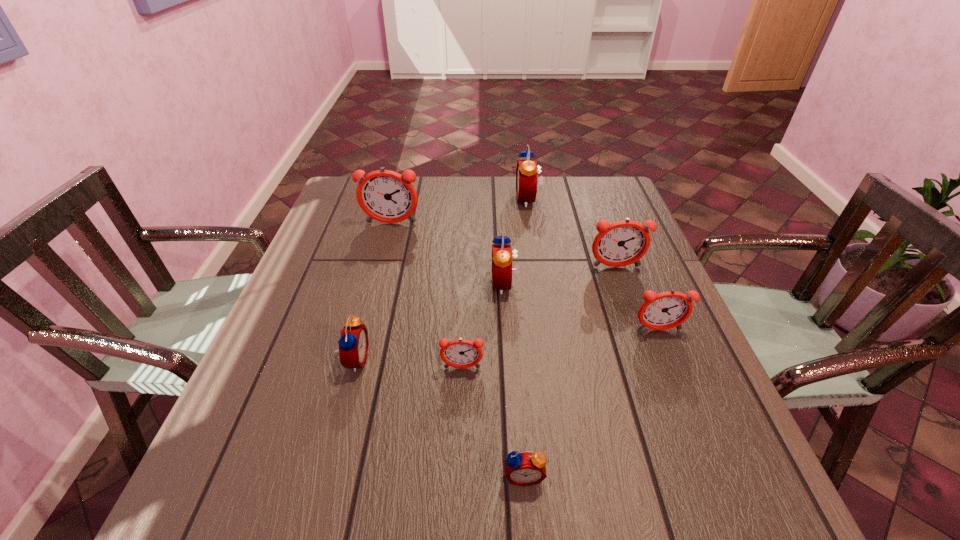
Where is `the farthest red alarm clock`? The width and height of the screenshot is (960, 540). the farthest red alarm clock is located at coordinates (526, 172).

The width and height of the screenshot is (960, 540). Find the location of `the sixth object from left to right`. the sixth object from left to right is located at coordinates (526, 172).

At what (x,y) coordinates should I click in order to perform the action: click on the leftmost reddish-pink alarm clock. Please return your answer as a coordinate pair (x, y). This screenshot has height=540, width=960. Looking at the image, I should click on (386, 196).

Locate an element on the screen. Image resolution: width=960 pixels, height=540 pixels. the biggest reddish-pink alarm clock is located at coordinates (386, 196).

Find the location of a particular element. The width and height of the screenshot is (960, 540). the second biggest red alarm clock is located at coordinates (502, 257).

Find the location of a particular element. the third smallest reddish-pink alarm clock is located at coordinates (622, 243).

Where is `the leftmost red alarm clock`? the leftmost red alarm clock is located at coordinates (353, 343).

This screenshot has height=540, width=960. I want to click on the second nearest red alarm clock, so click(353, 343).

Locate an element on the screen. This screenshot has height=540, width=960. the fifth farthest alarm clock is located at coordinates (666, 310).

Identify the location of the fifth farthest object. (666, 310).